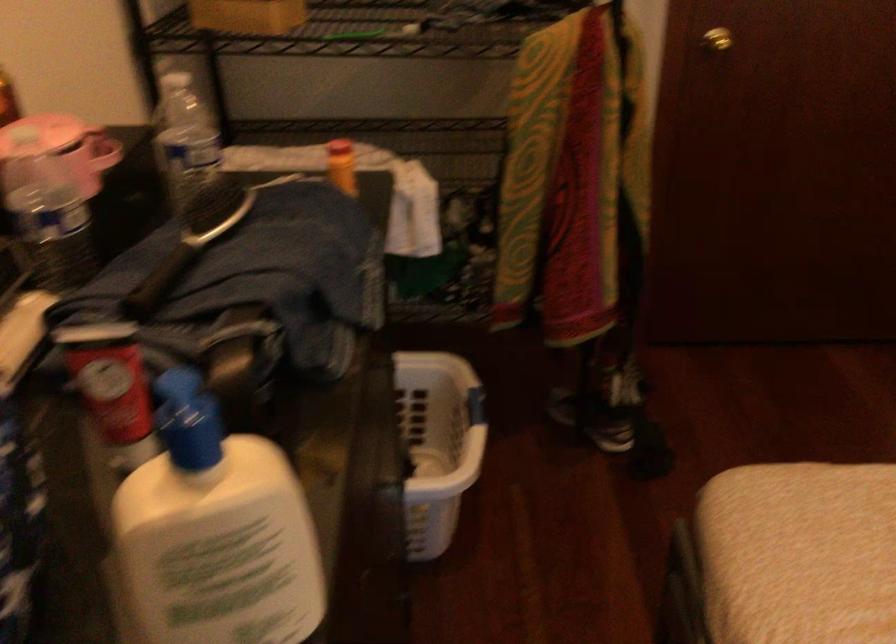
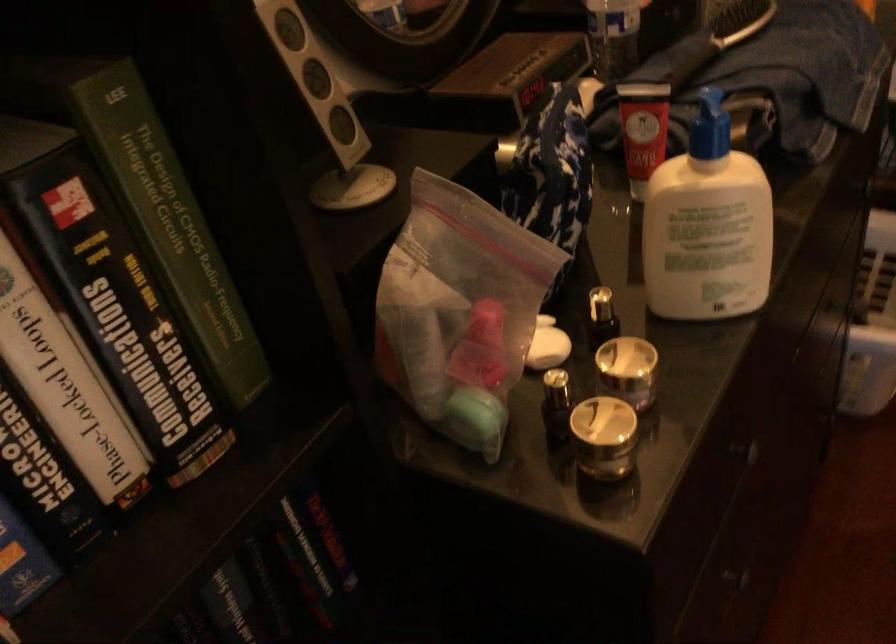
The point at [194,430] is marked in the first image. Where is the corresponding point in the second image?

(709, 126)